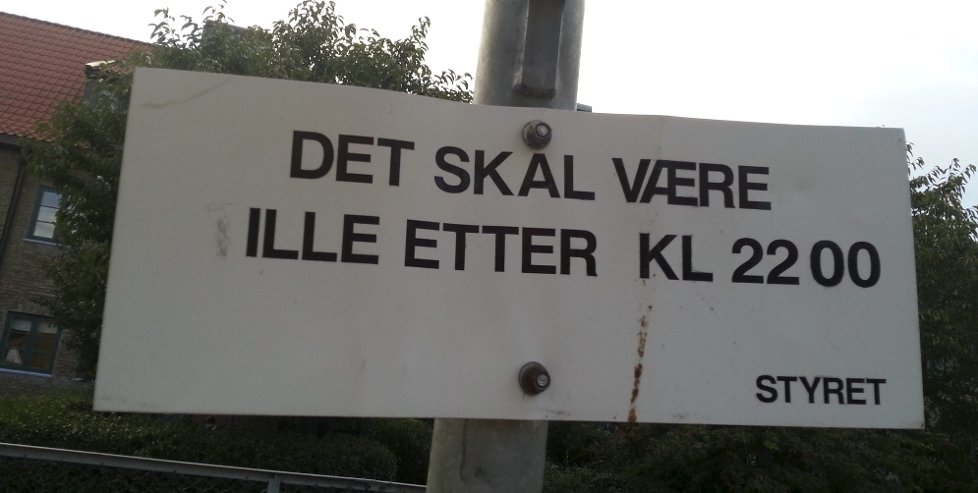
I want to click on handrail, so click(328, 479).